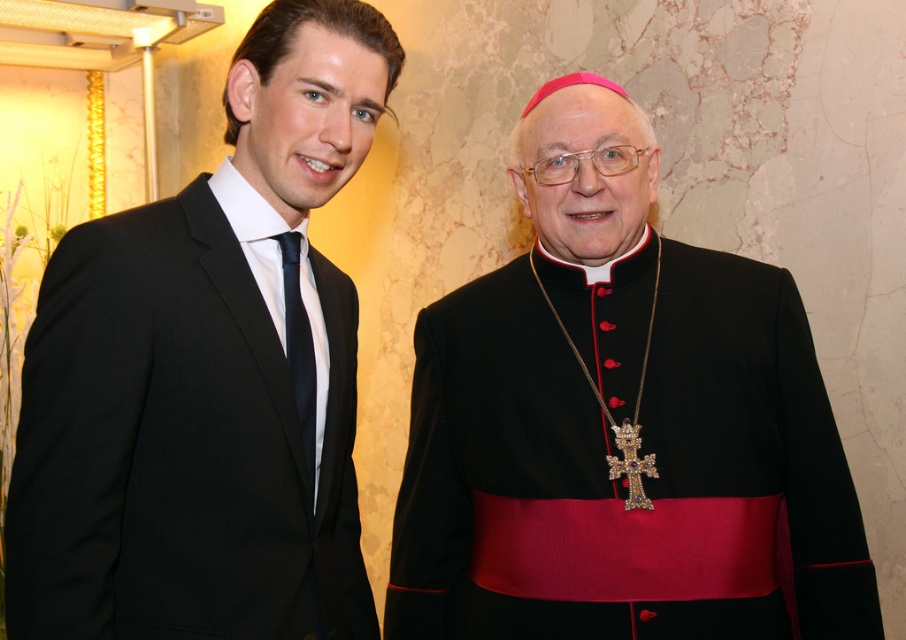
Who is lower down, black velvet cassock at center or black satin suit at left?

black velvet cassock at center is below.

Is black velvet cassock at center further to camera compared to black satin suit at left?

That is True.

Between point (638, 276) and point (323, 490), which one is positioned in front?

Positioned in front is point (323, 490).

Locate an element on the screen. black velvet cassock at center is located at coordinates point(620,424).

Is black velvet cassock at center smaller than matte black tie at left?

Incorrect, black velvet cassock at center is not smaller in size than matte black tie at left.

Between black velvet cassock at center and matte black tie at left, which one has less height?

With less height is matte black tie at left.

Where is `black velvet cassock at center`? black velvet cassock at center is located at coordinates (620, 424).

Is black satin suit at left behind matte black tie at left?

No, black satin suit at left is closer to the viewer.

How far apart are black satin suit at left and matte black tie at left?

black satin suit at left and matte black tie at left are 5.24 inches apart.

Which is in front, point (331, 589) or point (299, 298)?

Point (299, 298)

Where is `black satin suit at left`? The height and width of the screenshot is (640, 906). black satin suit at left is located at coordinates (208, 376).